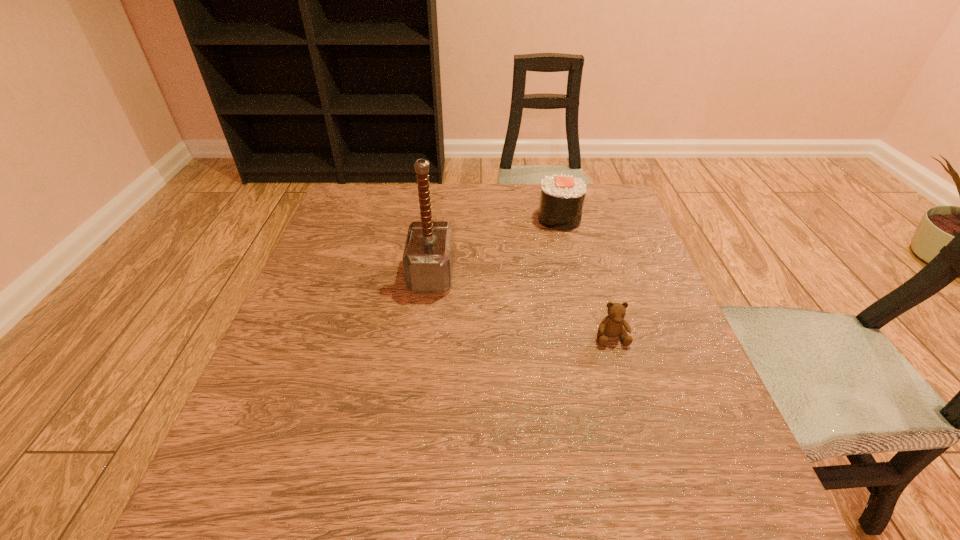
Where is `the tallest object`? The image size is (960, 540). the tallest object is located at coordinates (428, 255).

At what (x,y) coordinates should I click in order to perform the action: click on the leftmost object. Please return your answer as a coordinate pair (x, y). Looking at the image, I should click on (428, 255).

Find the location of `the second tallest object`. the second tallest object is located at coordinates (562, 197).

This screenshot has width=960, height=540. What are the coordinates of `sushi` in the screenshot? It's located at (562, 197).

Where is `the nearest object`? This screenshot has height=540, width=960. the nearest object is located at coordinates (611, 326).

I want to click on the shortest object, so click(x=611, y=326).

Where is `free spot located on the right of the leftmost object`? free spot located on the right of the leftmost object is located at coordinates (560, 274).

Where is `free space located 0.050m on the right of the sushi`? Image resolution: width=960 pixels, height=540 pixels. free space located 0.050m on the right of the sushi is located at coordinates (599, 218).

Where is `free space located 0.210m on the front-facing side of the shortest object`? This screenshot has width=960, height=540. free space located 0.210m on the front-facing side of the shortest object is located at coordinates (645, 450).

Identify the location of object present at the far edge. The image size is (960, 540). (562, 197).